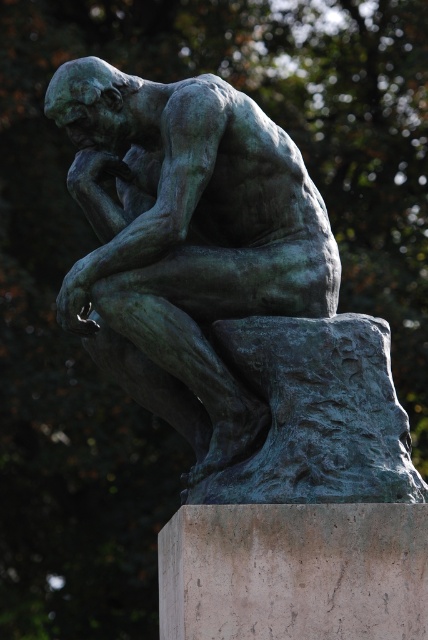
Question: Which point is farther from the camera taking this photo?

Choices:
 (A) (237, 113)
 (B) (359, 589)

Answer: (A)

Question: Does green patina bronze statue at center appear on the left side of marble pedestal at lower center?

Choices:
 (A) yes
 (B) no

Answer: (B)

Question: Can you confirm if green patina bronze statue at center is positioned above marble pedestal at lower center?

Choices:
 (A) no
 (B) yes

Answer: (B)

Question: Which point is closer to the camera?

Choices:
 (A) green patina bronze statue at center
 (B) marble pedestal at lower center

Answer: (B)

Question: Observing the image, what is the correct spatial positioning of green patina bronze statue at center in reference to marble pedestal at lower center?

Choices:
 (A) left
 (B) right

Answer: (B)

Question: Among these objects, which one is farthest from the camera?

Choices:
 (A) marble pedestal at lower center
 (B) green patina bronze statue at center

Answer: (B)